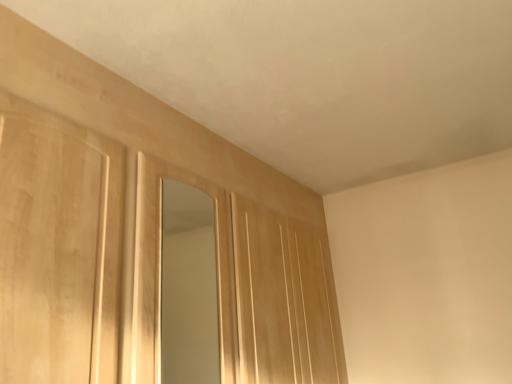
Question: Does light wood mirror at center have a lesser height compared to light wood paneling at center?

Choices:
 (A) no
 (B) yes

Answer: (B)

Question: Can you confirm if light wood mirror at center is positioned to the right of light wood paneling at center?

Choices:
 (A) no
 (B) yes

Answer: (A)

Question: Is light wood paneling at center at the back of light wood mirror at center?

Choices:
 (A) yes
 (B) no

Answer: (B)

Question: Can you confirm if light wood mirror at center is thinner than light wood paneling at center?

Choices:
 (A) yes
 (B) no

Answer: (A)

Question: Considering the relative positions of light wood mirror at center and light wood paneling at center in the image provided, is light wood mirror at center to the left of light wood paneling at center from the viewer's perspective?

Choices:
 (A) yes
 (B) no

Answer: (A)

Question: Can you confirm if light wood mirror at center is smaller than light wood paneling at center?

Choices:
 (A) yes
 (B) no

Answer: (A)

Question: From the image's perspective, is light wood paneling at center on light wood mirror at center?

Choices:
 (A) yes
 (B) no

Answer: (B)

Question: From a real-world perspective, is light wood paneling at center beneath light wood mirror at center?

Choices:
 (A) no
 (B) yes

Answer: (B)

Question: Is light wood paneling at center closer to the viewer compared to light wood mirror at center?

Choices:
 (A) no
 (B) yes

Answer: (A)

Question: Does light wood paneling at center have a smaller size compared to light wood mirror at center?

Choices:
 (A) no
 (B) yes

Answer: (A)

Question: Is light wood paneling at center looking in the opposite direction of light wood mirror at center?

Choices:
 (A) no
 (B) yes

Answer: (A)

Question: Is the depth of light wood paneling at center greater than that of light wood mirror at center?

Choices:
 (A) no
 (B) yes

Answer: (B)

Question: Would you say light wood paneling at center is to the left or to the right of light wood mirror at center in the picture?

Choices:
 (A) right
 (B) left

Answer: (A)